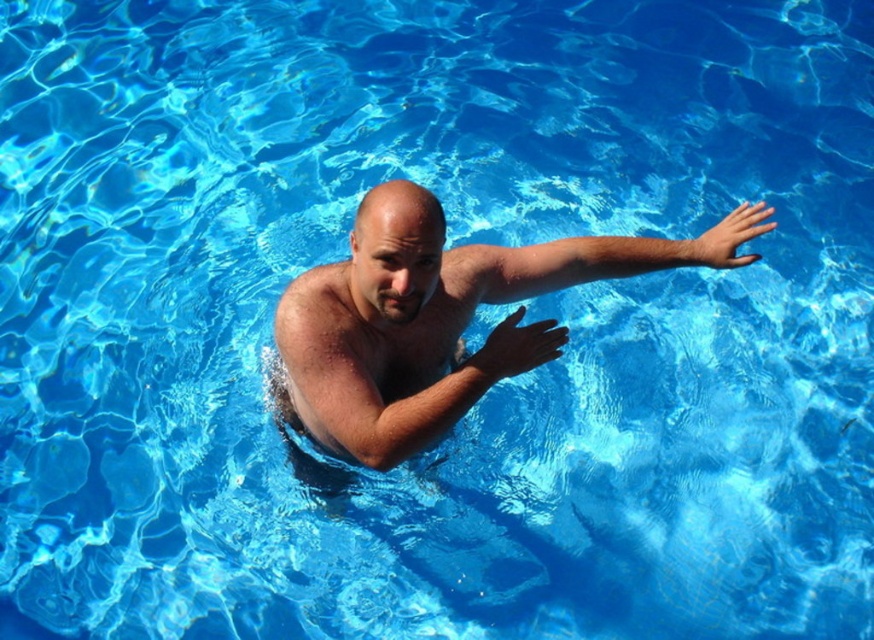
You are a lifeguard observing the pool from above. You notice a point marked at coordinates (376, 384). What object does this point correspond to in the pool?

The point at (376, 384) corresponds to the slick skin arm at center.

You are a photographer trying to capture the exact position of both arms in the image. Which arm, the slick skin arm at center or the slick skin arm at upper right, appears closer to the camera?

The slick skin arm at center appears closer to the camera because it is much taller than the slick skin arm at upper right, indicating it is positioned nearer in the frame.

You are a lifeguard observing a swimmer in the pool. You notice a specific point in the image labeled as point (376,384). Based on the scene, where is this point located on the swimmer?

The point (376,384) is located on the slick skin arm at center of the swimmer.